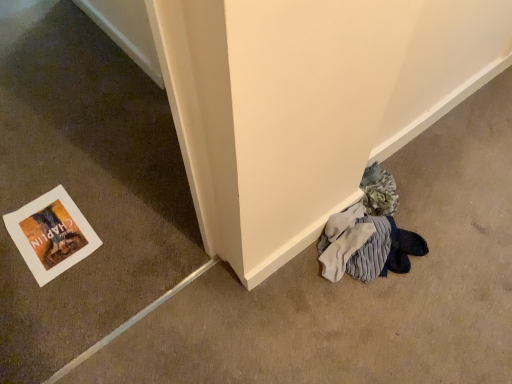
Question: From the image's perspective, relative to white paper at lower left, is white paper at lower left above or below?

Choices:
 (A) below
 (B) above

Answer: (B)

Question: Does point (31, 220) appear closer or farther from the camera than point (37, 102)?

Choices:
 (A) farther
 (B) closer

Answer: (B)

Question: Considering the positions of white paper at lower left and white paper at lower left in the image, is white paper at lower left bigger or smaller than white paper at lower left?

Choices:
 (A) big
 (B) small

Answer: (B)

Question: Is point (128, 162) positioned closer to the camera than point (51, 208)?

Choices:
 (A) closer
 (B) farther

Answer: (B)

Question: From a real-world perspective, is white paper at lower left physically located above or below white paper at lower left?

Choices:
 (A) above
 (B) below

Answer: (A)

Question: Visually, is white paper at lower left positioned to the left or to the right of white paper at lower left?

Choices:
 (A) left
 (B) right

Answer: (B)

Question: From the image's perspective, is white paper at lower left above or below white paper at lower left?

Choices:
 (A) above
 (B) below

Answer: (B)